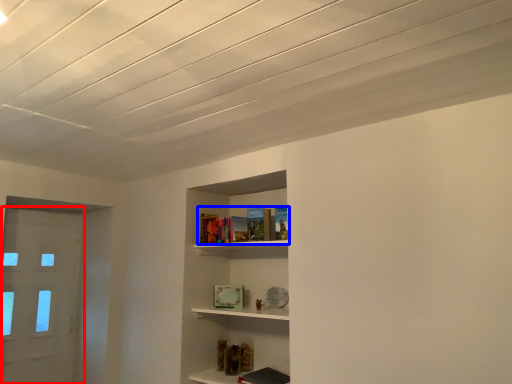
Question: Which object is further to the camera taking this photo, door (highlighted by a red box) or book (highlighted by a blue box)?

Choices:
 (A) door
 (B) book

Answer: (A)